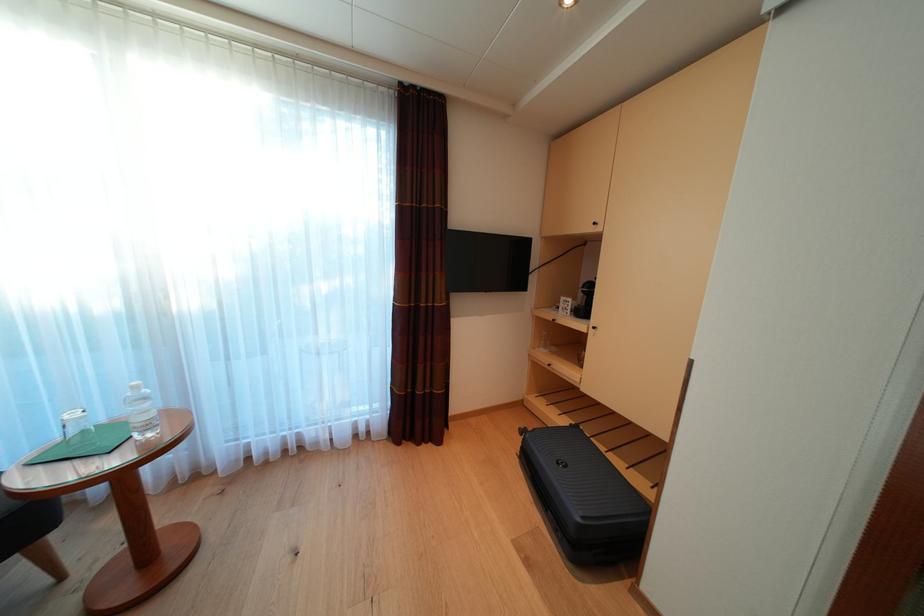
The image size is (924, 616). In order to click on drinking glass in this screenshot , I will do `click(79, 435)`.